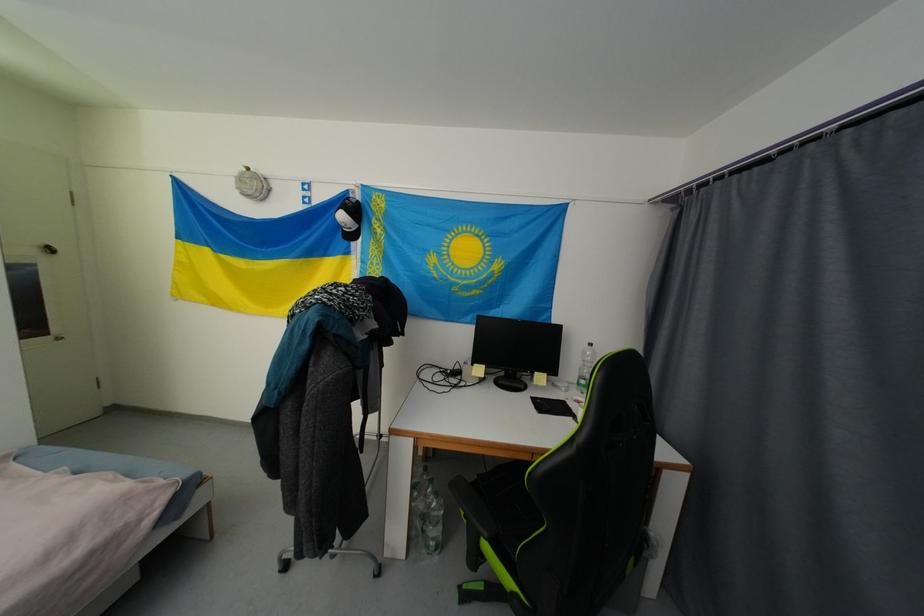
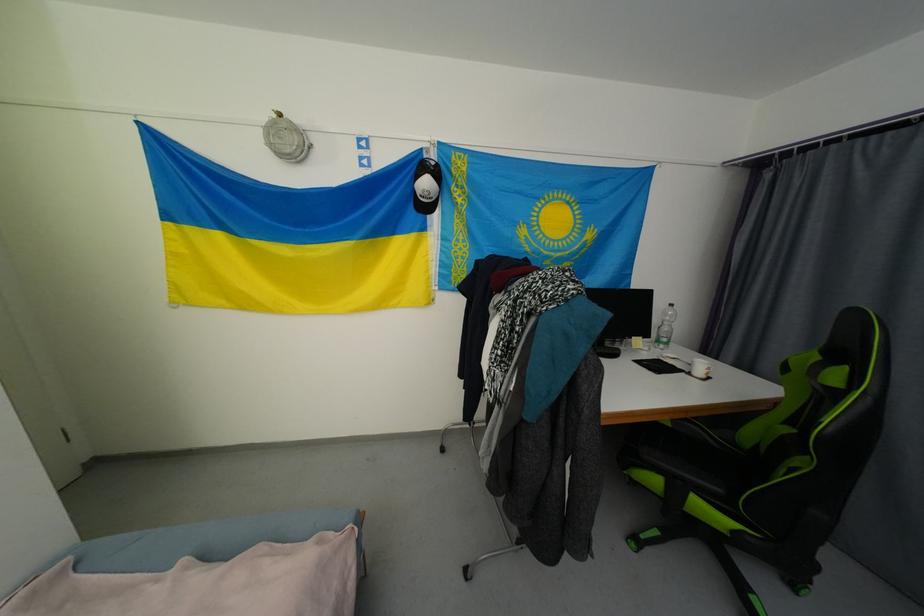
Question: The camera is either moving clockwise (left) or counter-clockwise (right) around the object. The first image is from the beginning of the video and the second image is from the end. Is the camera moving left or right when shooting the video?

Choices:
 (A) Left
 (B) Right

Answer: (A)